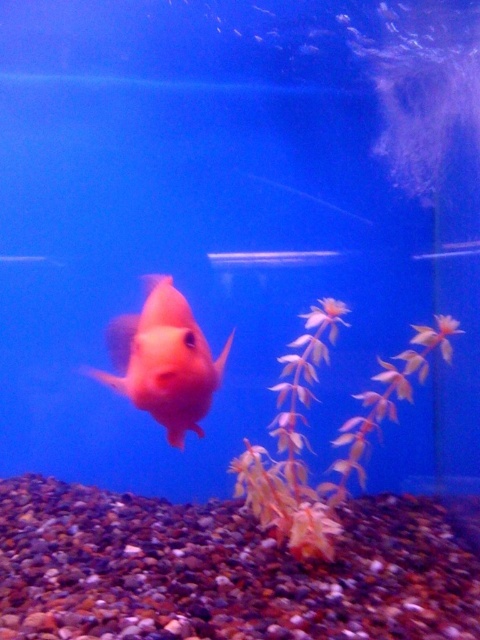
Does point (373, 428) come farther from viewer compared to point (169, 353)?

That is True.

Is yellow matte plant at center to the left of matte orange fish at center from the viewer's perspective?

No, yellow matte plant at center is not to the left of matte orange fish at center.

The image size is (480, 640). Identify the location of yellow matte plant at center. (332, 442).

The image size is (480, 640). I want to click on yellow matte plant at center, so click(x=332, y=442).